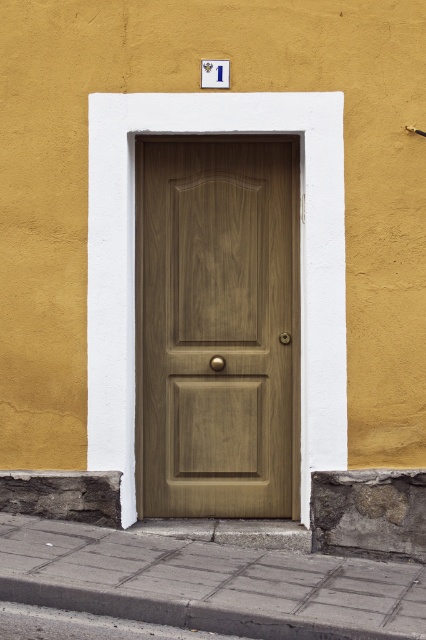
Question: Is wooden door at center above gray concrete pavement at lower center?

Choices:
 (A) no
 (B) yes

Answer: (B)

Question: Which object appears farthest from the camera in this image?

Choices:
 (A) wooden door at center
 (B) gray concrete pavement at lower center

Answer: (A)

Question: Which object appears farthest from the camera in this image?

Choices:
 (A) gray concrete pavement at lower center
 (B) wooden door at center

Answer: (B)

Question: Is wooden door at center positioned before gray concrete pavement at lower center?

Choices:
 (A) yes
 (B) no

Answer: (B)

Question: Can you confirm if wooden door at center is positioned below gray concrete pavement at lower center?

Choices:
 (A) yes
 (B) no

Answer: (B)

Question: Which object is farther from the camera taking this photo?

Choices:
 (A) gray concrete pavement at lower center
 (B) wooden door at center

Answer: (B)